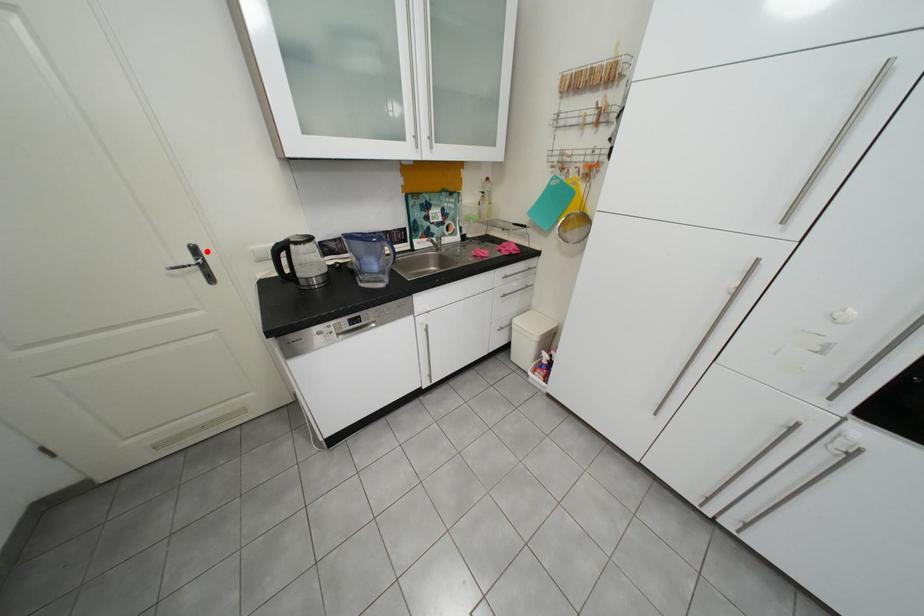
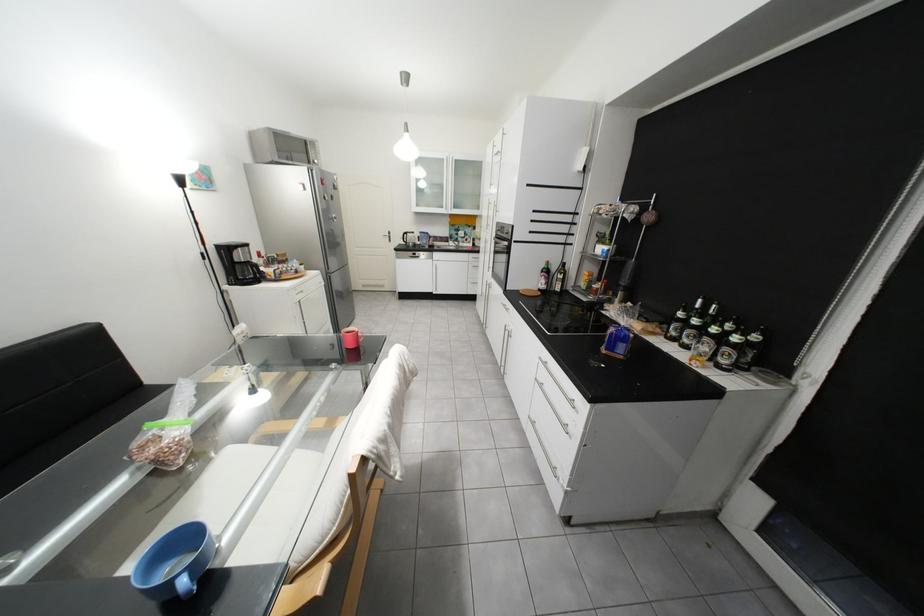
Question: I am providing you with two images of the same scene from different viewpoints. Given a red point in image1, look at the same physical point in image2. Is it:

Choices:
 (A) Closer to the viewpoint
 (B) Farther from the viewpoint

Answer: (A)